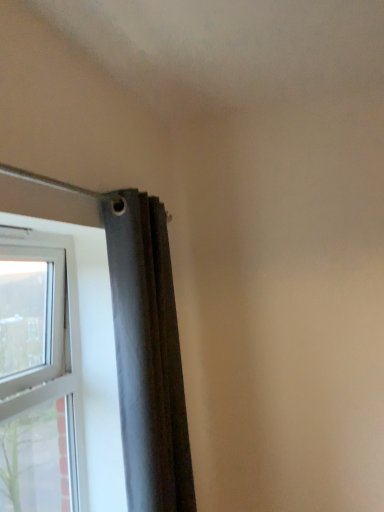
Question: Are white plastic window at left and dark gray fabric curtain at upper left making contact?

Choices:
 (A) no
 (B) yes

Answer: (A)

Question: From a real-world perspective, is white plastic window at left below dark gray fabric curtain at upper left?

Choices:
 (A) no
 (B) yes

Answer: (B)

Question: Is white plastic window at left at the left side of dark gray fabric curtain at upper left?

Choices:
 (A) no
 (B) yes

Answer: (B)

Question: Considering the relative sizes of white plastic window at left and dark gray fabric curtain at upper left in the image provided, is white plastic window at left shorter than dark gray fabric curtain at upper left?

Choices:
 (A) no
 (B) yes

Answer: (B)

Question: Is white plastic window at left thinner than dark gray fabric curtain at upper left?

Choices:
 (A) yes
 (B) no

Answer: (A)

Question: From the image's perspective, is white plastic window at left located above dark gray fabric curtain at upper left?

Choices:
 (A) no
 (B) yes

Answer: (A)

Question: From a real-world perspective, is dark gray fabric curtain at upper left over white plastic window at left?

Choices:
 (A) no
 (B) yes

Answer: (B)

Question: Considering the relative sizes of dark gray fabric curtain at upper left and white plastic window at left in the image provided, is dark gray fabric curtain at upper left bigger than white plastic window at left?

Choices:
 (A) no
 (B) yes

Answer: (B)

Question: Is white plastic window at left at the back of dark gray fabric curtain at upper left?

Choices:
 (A) no
 (B) yes

Answer: (B)

Question: Does dark gray fabric curtain at upper left have a lesser width compared to white plastic window at left?

Choices:
 (A) no
 (B) yes

Answer: (A)

Question: Is dark gray fabric curtain at upper left at the left side of white plastic window at left?

Choices:
 (A) no
 (B) yes

Answer: (A)

Question: Considering the relative positions of dark gray fabric curtain at upper left and white plastic window at left in the image provided, is dark gray fabric curtain at upper left behind white plastic window at left?

Choices:
 (A) no
 (B) yes

Answer: (B)

Question: From a real-world perspective, is white plastic window at left above or below dark gray fabric curtain at upper left?

Choices:
 (A) above
 (B) below

Answer: (B)